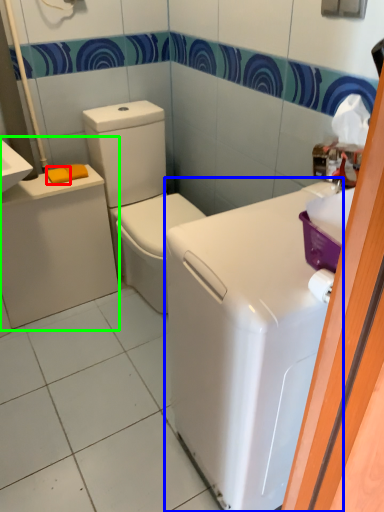
Question: Considering the real-world distances, which object is farthest from soap (highlighted by a red box)? appliance (highlighted by a blue box) or porcelain (highlighted by a green box)?

Choices:
 (A) appliance
 (B) porcelain

Answer: (A)